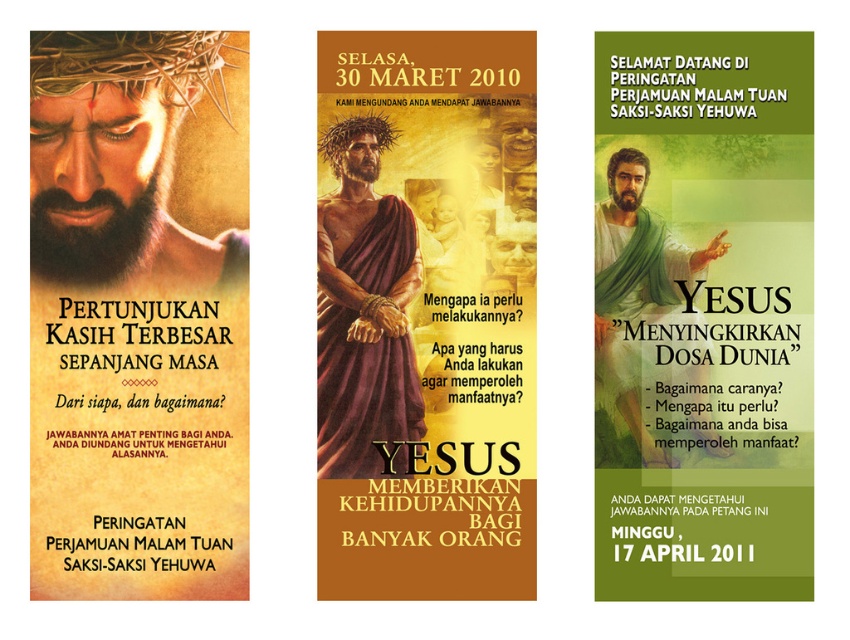
Question: Among these points, which one is nearest to the camera?

Choices:
 (A) (29, 60)
 (B) (83, 36)
 (C) (401, 388)

Answer: (C)

Question: Can you confirm if matte gold text at center is positioned to the right of matte black face at upper left?

Choices:
 (A) no
 (B) yes

Answer: (B)

Question: Considering the relative positions of green matte banner at center and matte gold text at center in the image provided, where is green matte banner at center located with respect to matte gold text at center?

Choices:
 (A) left
 (B) right

Answer: (B)

Question: Is matte gold text at center closer to the viewer compared to green cloth at center?

Choices:
 (A) no
 (B) yes

Answer: (A)

Question: Which object is the closest to the matte gold text at center?

Choices:
 (A) matte gold crown of thorns at upper left
 (B) green cloth at center

Answer: (B)

Question: Among these points, which one is farthest from the camera?

Choices:
 (A) (64, 196)
 (B) (667, 324)
 (C) (95, 298)

Answer: (A)